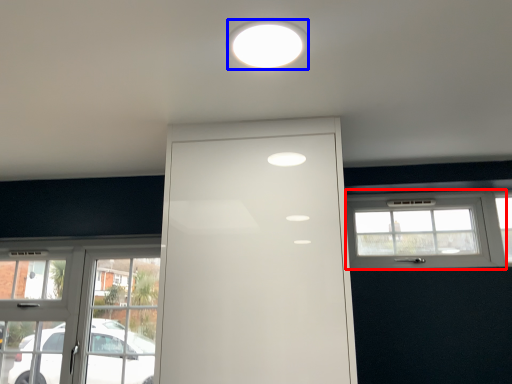
Question: Which of the following is the closest to the observer, window (highlighted by a red box) or lighting (highlighted by a blue box)?

Choices:
 (A) window
 (B) lighting

Answer: (B)